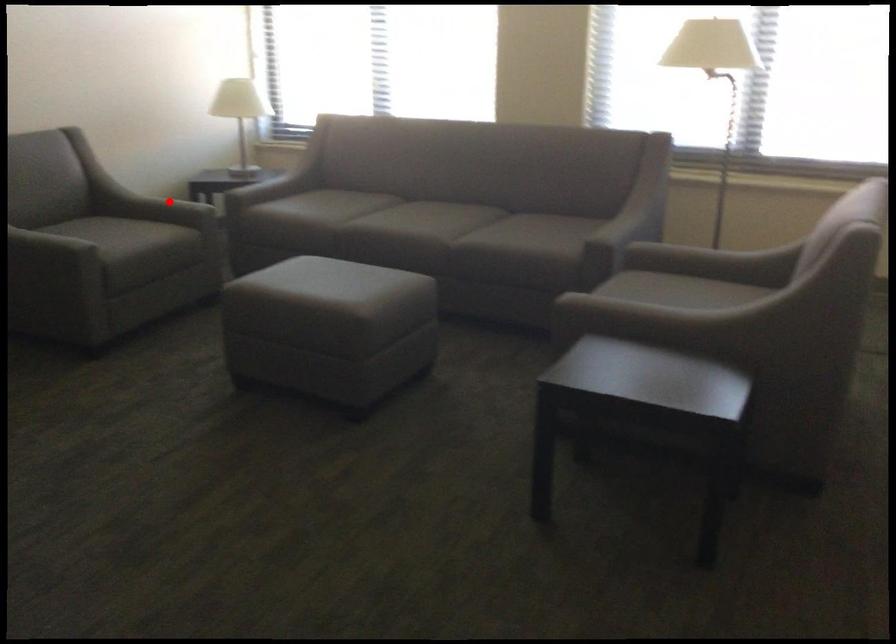
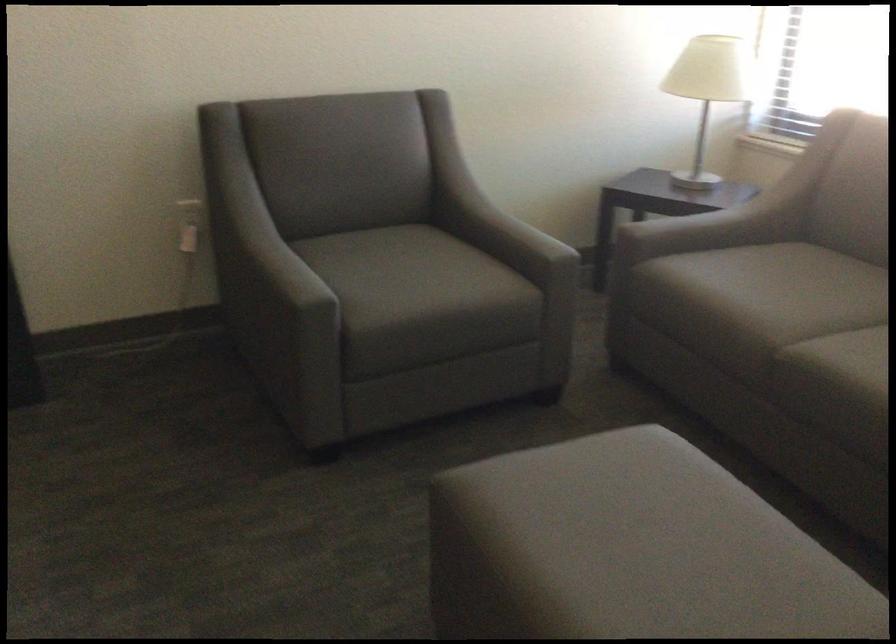
Question: I am providing you with two images of the same scene from different viewpoints. Image1 has a red point marked. In image2, the corresponding 3D location appears at what relative position? Reply with the corresponding letter.

Choices:
 (A) Closer
 (B) Farther

Answer: (A)